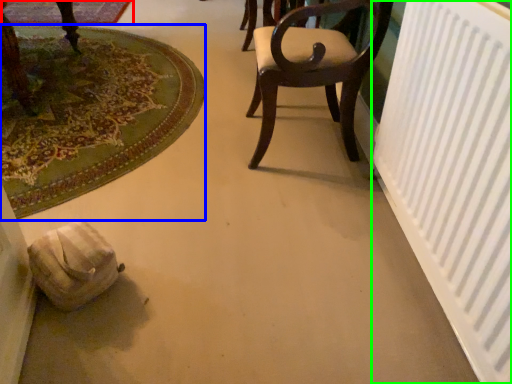
Question: Based on their relative distances, which object is farther from mat (highlighted by a red box)? Choose from mat (highlighted by a blue box) and radiator (highlighted by a green box).

Choices:
 (A) mat
 (B) radiator

Answer: (B)